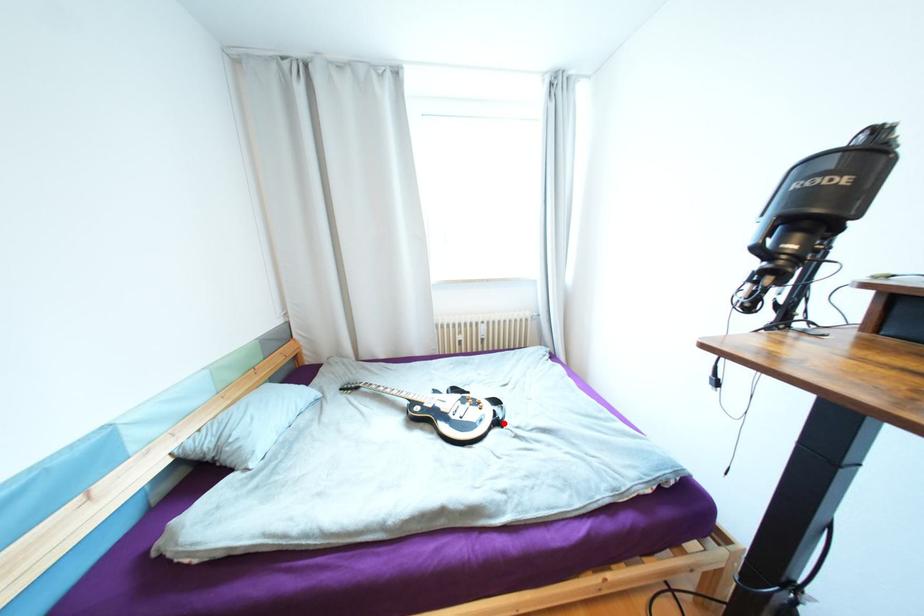
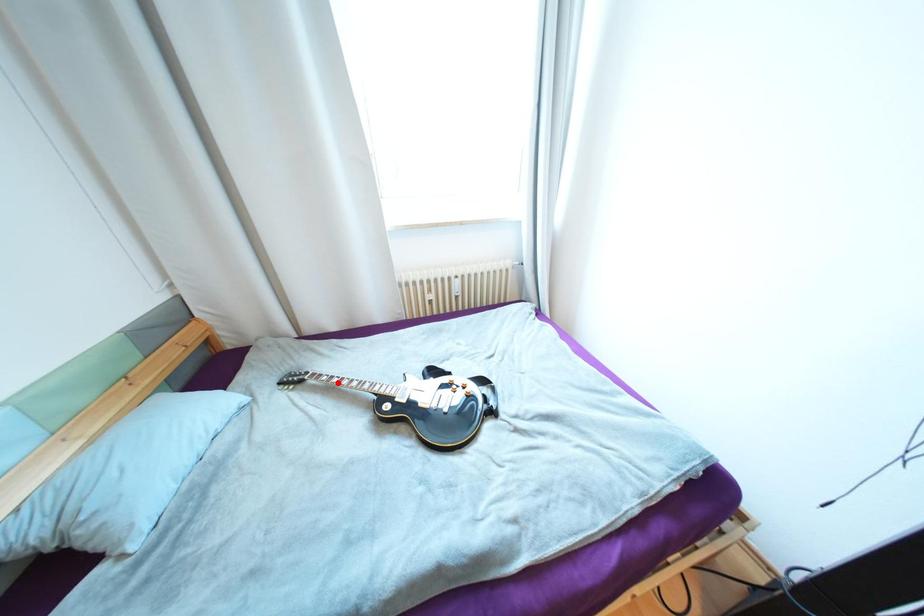
I am providing you with two images of the same scene from different viewpoints. A red point is marked on the first image and another point is marked on the second image. Is the red point in image1 aligned with the point shown in image2?

No